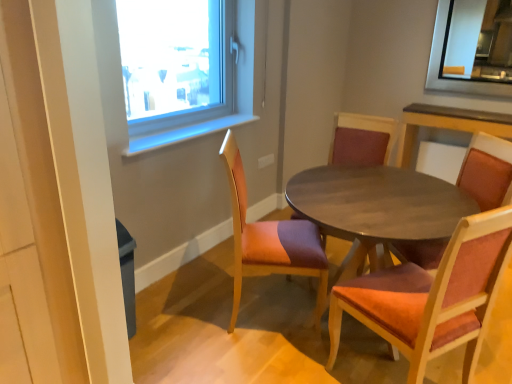
Identify the location of vacant space in front of wooden textured chair at center, placed as the 4th chair when sorted from right to left. The image size is (512, 384). (244, 360).